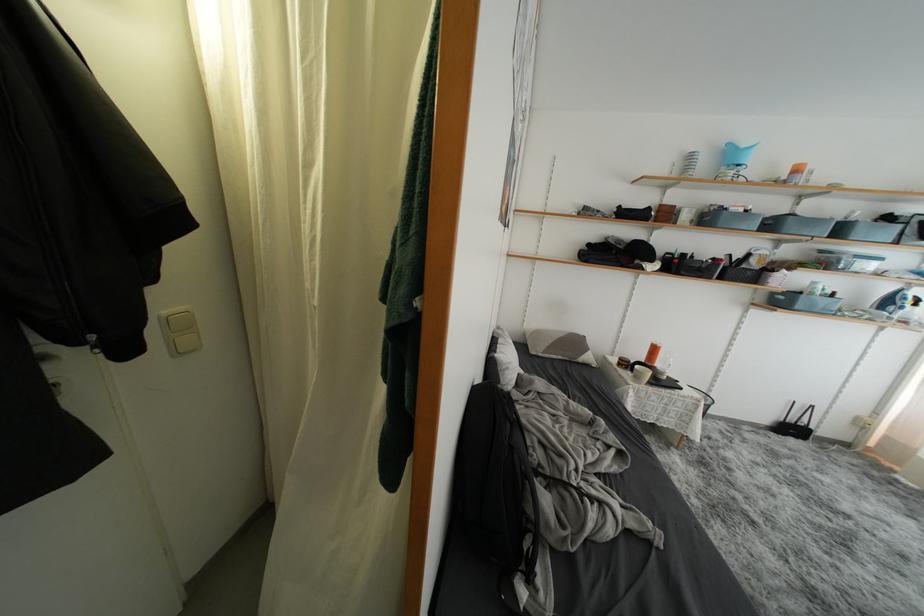
The image size is (924, 616). What do you see at coordinates (642, 374) in the screenshot?
I see `the white mug handle` at bounding box center [642, 374].